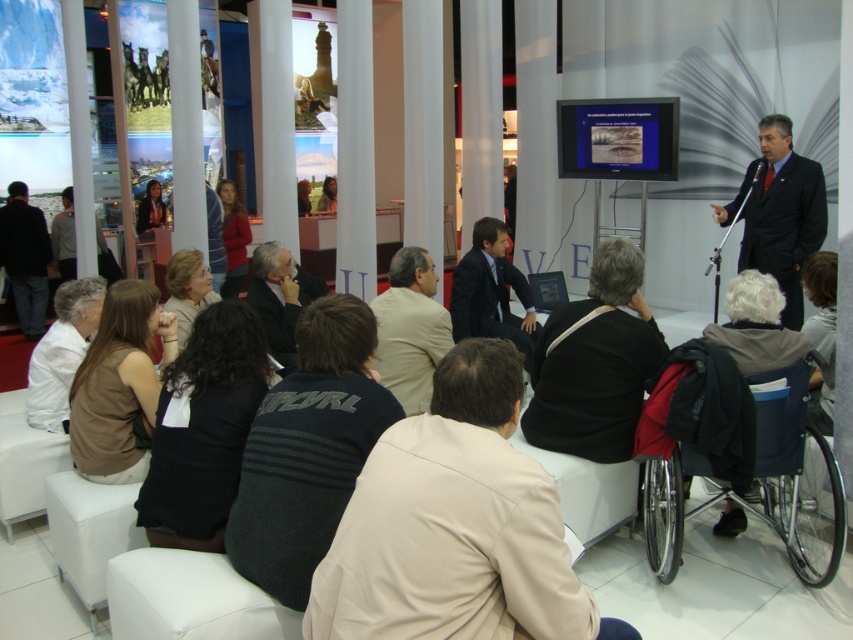
You are standing in the conference hall and want to move from the speaker to the nearest exit. The speaker is at point (410,472) and the exit is at point (0,221). Which direction should you walk to get closer to the exit?

Since point (410,472) is closer to the viewer than point (0,221), you should walk towards the lower part of the image to move away from the speaker and closer to the exit at (0,221).

You are standing in the front row of the presentation and want to walk to the back of the room. Which point, point(741, 513) or point(268, 252), is closer to your starting position?

Point(741, 513) is closer to the viewer than point(268, 252), so it is closer to your starting position in the front row.

You are organizing a photo shoot for a clothing brand and need to highlight both the dark gray knit sweater at center and the light beige suit at center in the same frame. Given their spatial arrangement, which clothing item will appear smaller in the photo?

The dark gray knit sweater at center will appear smaller in the photo because it occupies less space than the light beige suit at center.